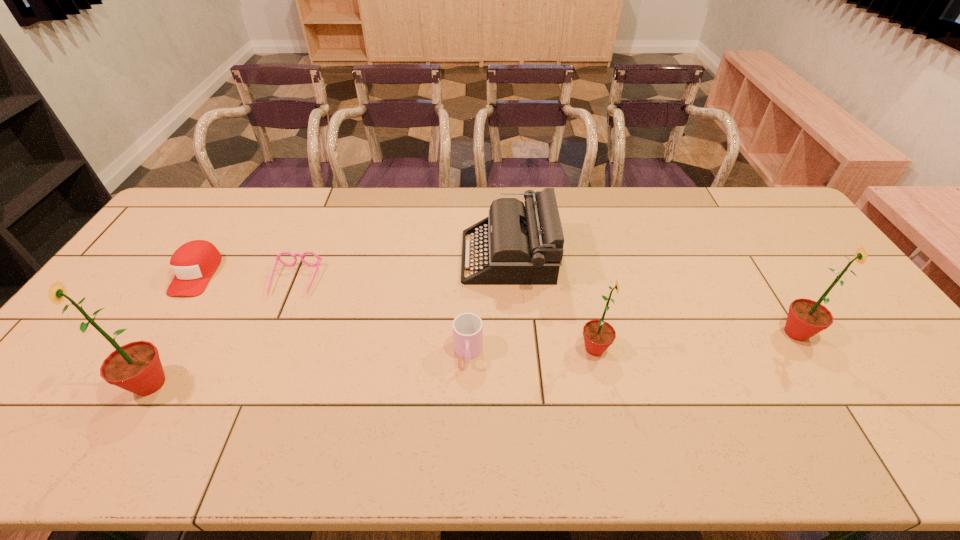
At what (x,y) coordinates should I click in order to perform the action: click on the nearest sunflower. Please return your answer as a coordinate pair (x, y). The image size is (960, 540). Looking at the image, I should click on (136, 367).

Image resolution: width=960 pixels, height=540 pixels. Identify the location of the second object from right to left. (598, 335).

Where is `the third tallest object`? Image resolution: width=960 pixels, height=540 pixels. the third tallest object is located at coordinates (598, 335).

Find the location of a particular element. the rightmost sunflower is located at coordinates (806, 318).

Where is `the second tallest object`? This screenshot has width=960, height=540. the second tallest object is located at coordinates (806, 318).

At what (x,y) coordinates should I click in order to perform the action: click on the shortest object. Please return your answer as a coordinate pair (x, y). Looking at the image, I should click on (317, 264).

Where is `spectacles`? This screenshot has width=960, height=540. spectacles is located at coordinates (317, 264).

The image size is (960, 540). I want to click on baseball cap, so click(193, 263).

The height and width of the screenshot is (540, 960). Identify the location of the fourth shortest object. (524, 244).

The image size is (960, 540). Identify the location of cup. (467, 327).